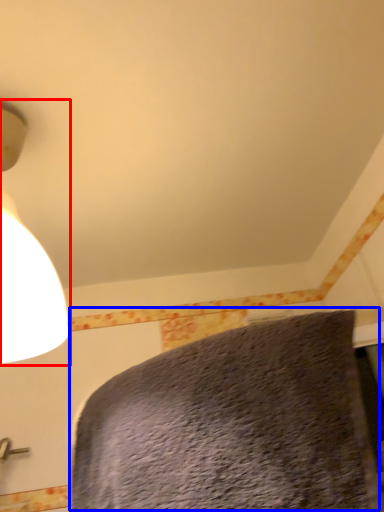
Question: Which object is closer to the camera taking this photo, lamp (highlighted by a red box) or bed (highlighted by a blue box)?

Choices:
 (A) lamp
 (B) bed

Answer: (B)